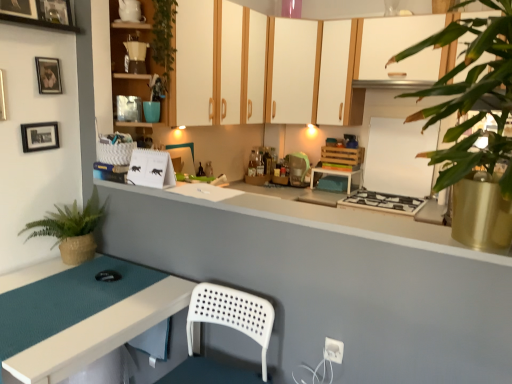
Question: Is matte yellow coffee maker at upper center positioned before wooden picture frame at upper left, the 3th picture frame when ordered from bottom to top?

Choices:
 (A) yes
 (B) no

Answer: (B)

Question: From the image's perspective, is matte yellow coffee maker at upper center over wooden picture frame at upper left, the 3th picture frame when ordered from bottom to top?

Choices:
 (A) no
 (B) yes

Answer: (A)

Question: Is matte yellow coffee maker at upper center aimed at wooden picture frame at upper left, which appears as the 1th picture frame when viewed from the top?

Choices:
 (A) no
 (B) yes

Answer: (A)

Question: Does matte yellow coffee maker at upper center have a greater width compared to wooden picture frame at upper left, which appears as the 1th picture frame when viewed from the top?

Choices:
 (A) yes
 (B) no

Answer: (A)

Question: From a real-world perspective, does matte yellow coffee maker at upper center stand above wooden picture frame at upper left, which appears as the 1th picture frame when viewed from the top?

Choices:
 (A) no
 (B) yes

Answer: (A)

Question: Considering the relative positions of matte yellow coffee maker at upper center and wooden picture frame at upper left, which appears as the 1th picture frame when viewed from the top, in the image provided, is matte yellow coffee maker at upper center behind wooden picture frame at upper left, which appears as the 1th picture frame when viewed from the top,?

Choices:
 (A) no
 (B) yes

Answer: (B)

Question: Is matte yellow coffee maker at upper center a part of white matte cabinet at upper center, placed as the 1th cabinetry when sorted from right to left?

Choices:
 (A) yes
 (B) no

Answer: (B)

Question: Does white matte cabinet at upper center, which is the third cabinetry from front to back, have a larger size compared to matte yellow coffee maker at upper center?

Choices:
 (A) yes
 (B) no

Answer: (A)

Question: Considering the relative positions of white matte cabinet at upper center, the third cabinetry from the left, and matte yellow coffee maker at upper center in the image provided, is white matte cabinet at upper center, the third cabinetry from the left, in front of matte yellow coffee maker at upper center?

Choices:
 (A) yes
 (B) no

Answer: (B)

Question: From a real-world perspective, is white matte cabinet at upper center, placed as the 1th cabinetry when sorted from right to left, located beneath matte yellow coffee maker at upper center?

Choices:
 (A) yes
 (B) no

Answer: (A)

Question: Can you confirm if white matte cabinet at upper center, which is the third cabinetry from front to back, is wider than matte yellow coffee maker at upper center?

Choices:
 (A) yes
 (B) no

Answer: (A)

Question: Considering the relative sizes of white matte cabinet at upper center, marked as the 1th cabinetry in a back-to-front arrangement, and matte yellow coffee maker at upper center in the image provided, is white matte cabinet at upper center, marked as the 1th cabinetry in a back-to-front arrangement, taller than matte yellow coffee maker at upper center?

Choices:
 (A) no
 (B) yes

Answer: (B)

Question: Are teal matte table at lower left, the 2th table positioned from the back, and teal glass jar at upper center far apart?

Choices:
 (A) no
 (B) yes

Answer: (B)